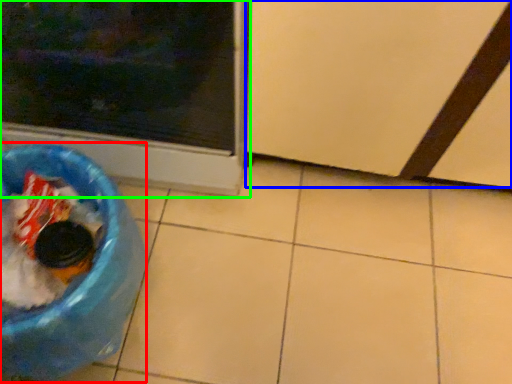
Question: Which object is the farthest from recycling bin (highlighted by a red box)? Choose among these: screen door (highlighted by a blue box) or home appliance (highlighted by a green box).

Choices:
 (A) screen door
 (B) home appliance

Answer: (A)